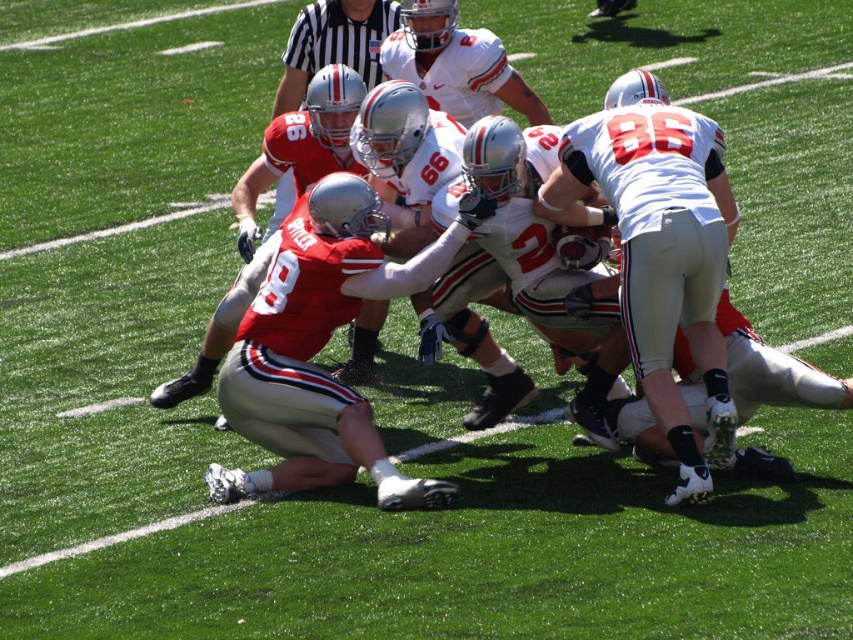
Which is below, matte silver helmet at center or black striped shirt at upper center?

matte silver helmet at center is below.

Does matte silver helmet at center have a smaller size compared to black striped shirt at upper center?

Yes, matte silver helmet at center is smaller than black striped shirt at upper center.

Who is more forward, (299,116) or (296,35)?

Point (299,116) is in front.

Find the location of a particular element. matte silver helmet at center is located at coordinates (231, 289).